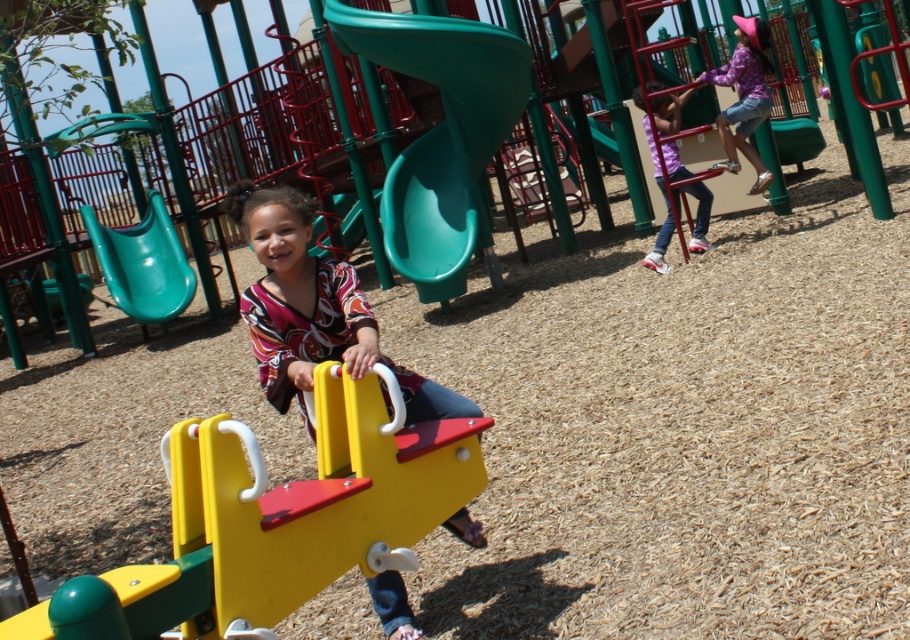
Question: Which object is positioned farthest from the green plastic slide at left?

Choices:
 (A) green plastic slide at center
 (B) yellow plastic seesaw at center
 (C) matte yellow seesaw at center

Answer: (B)

Question: Which object is positioned closest to the purple fabric shirt at upper right?

Choices:
 (A) yellow plastic seesaw at center
 (B) green plastic slide at left

Answer: (A)

Question: Does floral fabric shirt at upper right have a smaller size compared to purple fabric shirt at upper right?

Choices:
 (A) yes
 (B) no

Answer: (B)

Question: Considering the real-world distances, which object is closest to the matte yellow seesaw at center?

Choices:
 (A) yellow plastic seesaw at center
 (B) green plastic slide at left
 (C) green plastic slide at center

Answer: (A)

Question: Observing the image, what is the correct spatial positioning of yellow plastic seesaw at center in reference to green plastic slide at center?

Choices:
 (A) above
 (B) below

Answer: (B)

Question: Can you confirm if green plastic slide at center is positioned to the right of matte yellow seesaw at center?

Choices:
 (A) yes
 (B) no

Answer: (B)